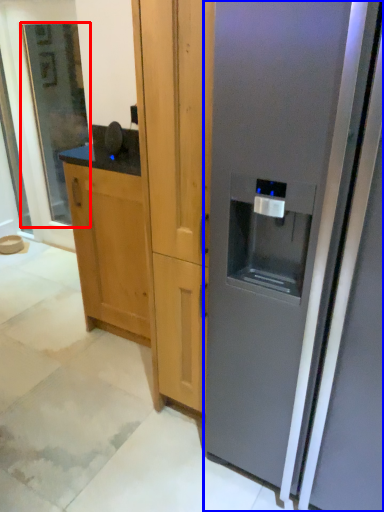
Question: Which object is further to the camera taking this photo, glass door (highlighted by a red box) or refrigerator (highlighted by a blue box)?

Choices:
 (A) glass door
 (B) refrigerator

Answer: (A)